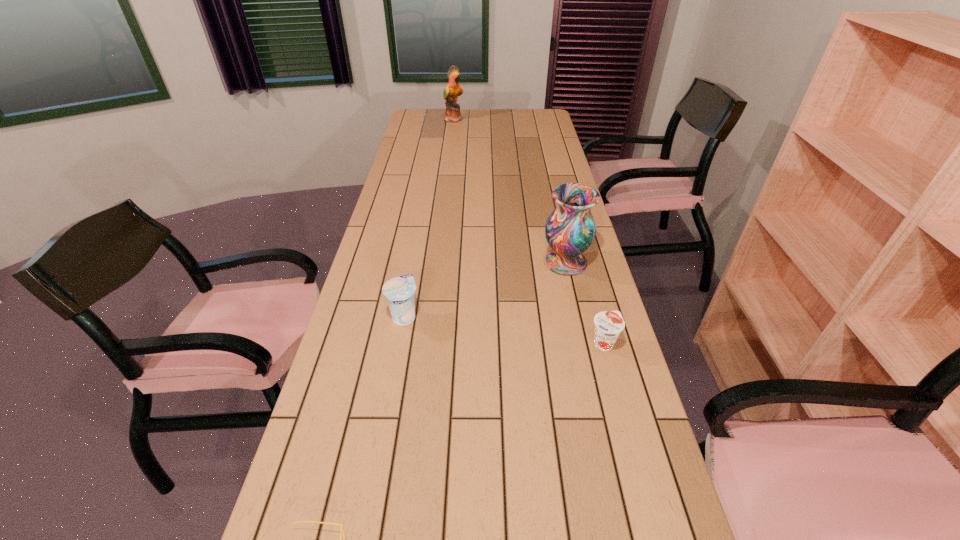
Where is `free space that is in between the taller yogurt and the parrot`? free space that is in between the taller yogurt and the parrot is located at coordinates (429, 218).

I want to click on free space between the vase and the farthest object, so click(x=510, y=191).

Locate an element on the screen. The image size is (960, 540). the fourth closest object to the taller yogurt is located at coordinates (453, 89).

Identify the location of the fourth closest object to the farthest object. (342, 529).

Find the location of a particular element. This screenshot has height=540, width=960. vacant space that satisfies the following two spatial constraints: 1. on the front-facing side of the farthest object; 2. on the back side of the fourth nearest object is located at coordinates (438, 262).

The image size is (960, 540). I want to click on free spot that satisfies the following two spatial constraints: 1. on the front-facing side of the fourth nearest object; 2. on the left side of the parrot, so click(438, 262).

Find the location of `blank area in the image that satisfies the following two spatial constraints: 1. on the back side of the second farthest object; 2. on the right side of the third nearest object`. blank area in the image that satisfies the following two spatial constraints: 1. on the back side of the second farthest object; 2. on the right side of the third nearest object is located at coordinates (414, 262).